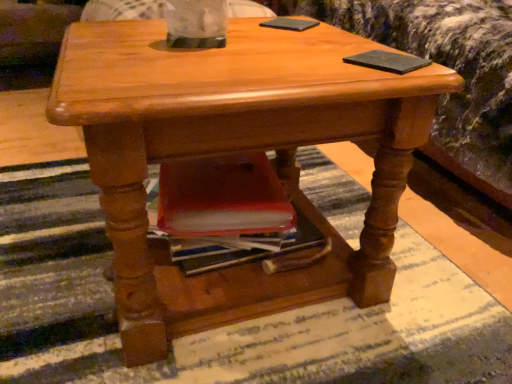
You are a GUI agent. You are given a task and a screenshot of the screen. Output one action in this format:
    pyautogui.click(x=<x>, y=<y>)
    Task: Click on the empty space that is in between green matte pad at upper center, which ranks as the 1th pad in top-to-bottom order, and black matte pad at upper right, positioned as the second pad in top-to-bottom order
    The height and width of the screenshot is (384, 512).
    Given the screenshot: What is the action you would take?
    pyautogui.click(x=332, y=41)